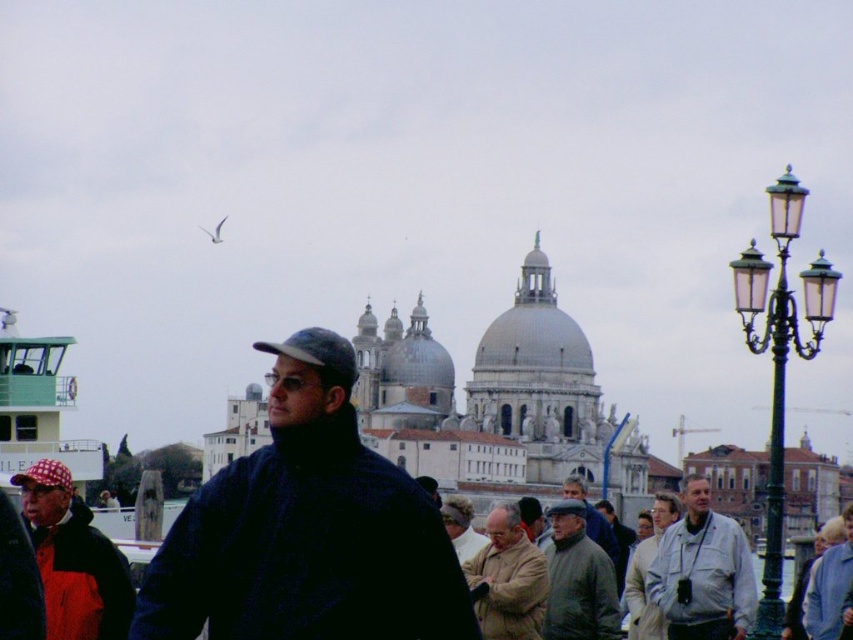
Is the position of red checkered cap at lower left less distant than that of gray wool sweater at center?

Yes, red checkered cap at lower left is closer to the viewer.

Can you confirm if red checkered cap at lower left is bigger than gray wool sweater at center?

Yes.

Is point (86, 564) in front of point (602, 560)?

Yes.

Locate an element on the screen. red checkered cap at lower left is located at coordinates coord(73,557).

Does green metal lamp post at right appear on the right side of light brown leather jacket at center?

Correct, you'll find green metal lamp post at right to the right of light brown leather jacket at center.

Who is positioned more to the right, green metal lamp post at right or light brown leather jacket at center?

Positioned to the right is green metal lamp post at right.

Which is behind, point (788, 166) or point (480, 620)?

Point (480, 620)

Locate an element on the screen. green metal lamp post at right is located at coordinates (779, 356).

Based on the photo, who is more distant from viewer, (576, 492) or (10, 477)?

Positioned behind is point (576, 492).

Can you confirm if gray woolen jacket at center is positioned to the left of checkered fabric baseball cap at left?

Incorrect, gray woolen jacket at center is not on the left side of checkered fabric baseball cap at left.

The width and height of the screenshot is (853, 640). I want to click on gray woolen jacket at center, so click(x=592, y=516).